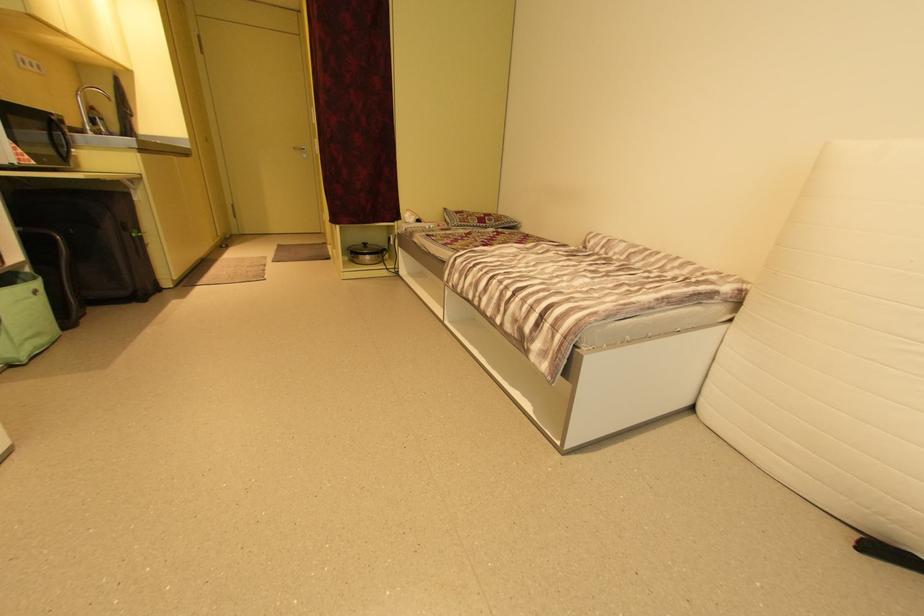
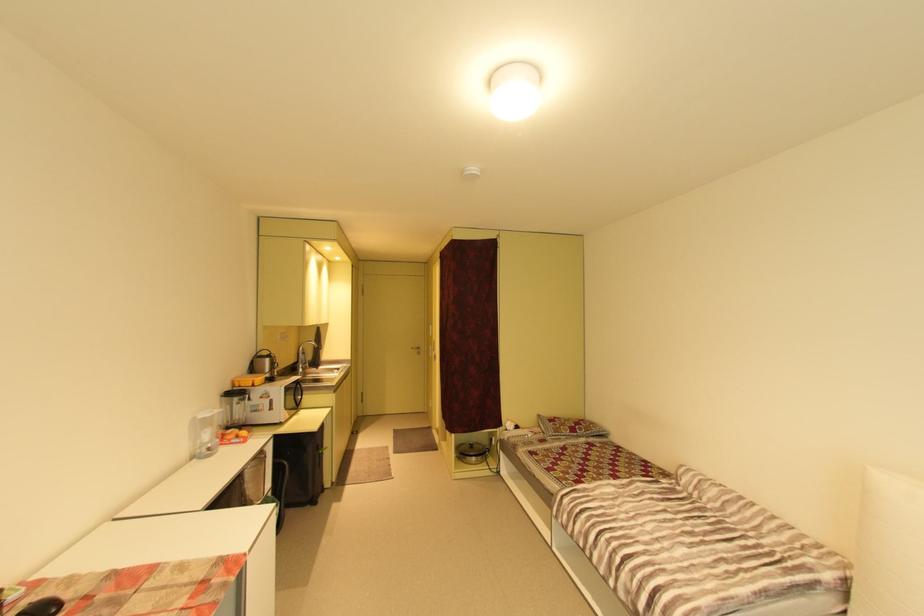
In the second image, find the point that corresponds to pixel 476 217 in the first image.

(568, 428)